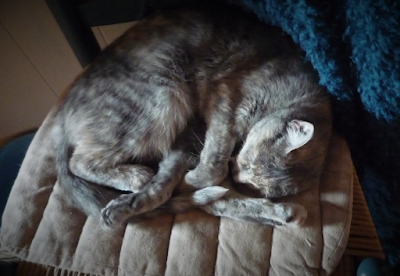
At what (x,y) coordinates should I click in order to perform the action: click on pillow. Please return your answer as a coordinate pair (x, y). This screenshot has height=276, width=400. Looking at the image, I should click on (296, 233).